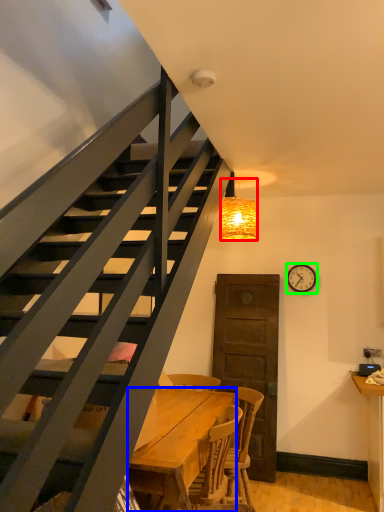
Question: Estimate the real-world distances between objects in this image. Which object is closer to lamp (highlighted by a red box), desk (highlighted by a blue box) or clock (highlighted by a green box)?

Choices:
 (A) desk
 (B) clock

Answer: (B)